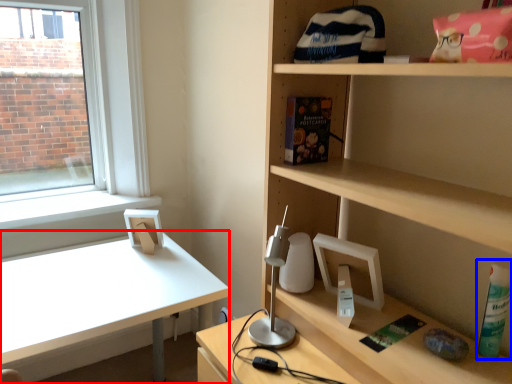
Question: Which object appears closest to the camera in this image, desk (highlighted by a red box) or bottle (highlighted by a blue box)?

Choices:
 (A) desk
 (B) bottle

Answer: (B)